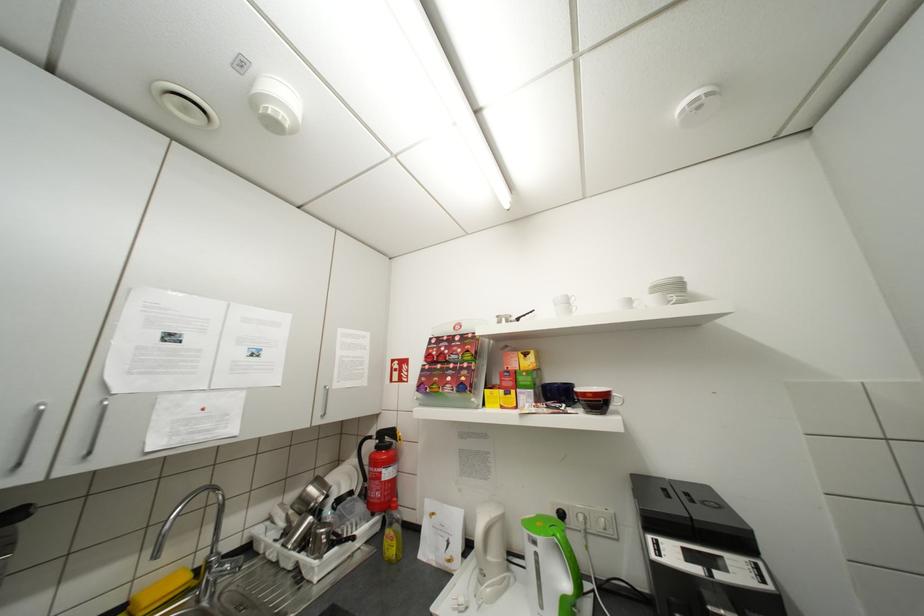
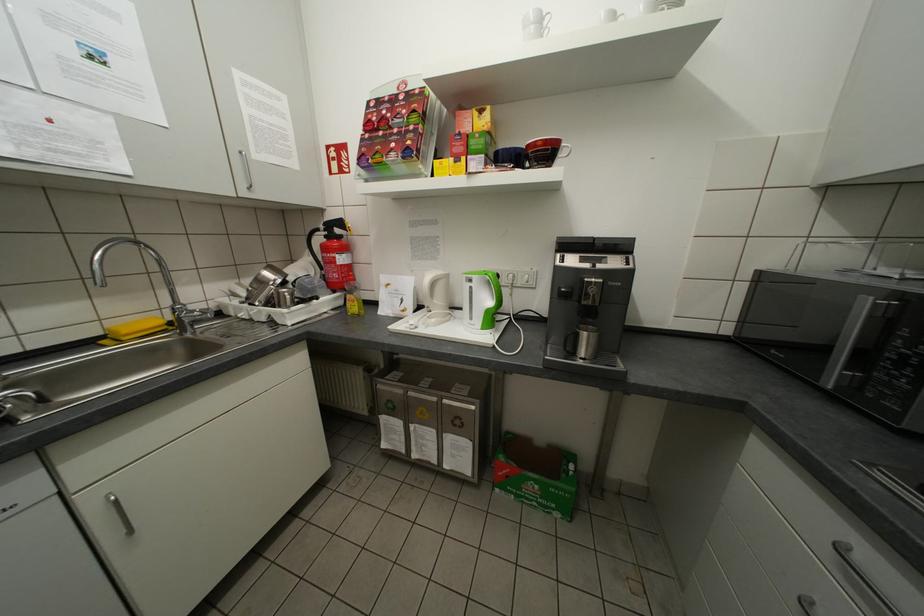
Where in the second image is the point corresponding to [379,438] from the first image?

(325, 230)